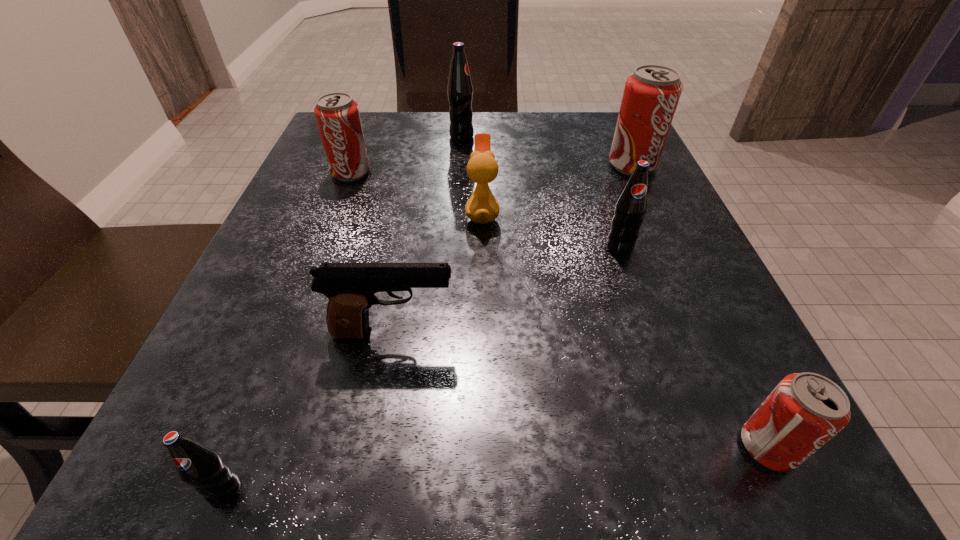
What are the coordinates of `vacant space that satisfies the following two spatial constraints: 1. on the beak of the tan duck; 2. on the right side of the nearest pink soda can` in the screenshot? It's located at (484, 447).

This screenshot has width=960, height=540. What are the coordinates of `free space that satisfies the following two spatial constraints: 1. at the barrel of the pistol; 2. on the right side of the nearest pink soda can` in the screenshot? It's located at (373, 447).

Locate an element on the screen. The image size is (960, 540). free spot that satisfies the following two spatial constraints: 1. on the beak of the duck; 2. on the front label of the leftmost black pop is located at coordinates (484, 490).

At what (x,y) coordinates should I click in order to perform the action: click on vacant space that satisfies the following two spatial constraints: 1. on the front label of the second black pop from right to left; 2. on the left side of the smallest pink soda can. Please return your answer as a coordinate pair (x, y). Looking at the image, I should click on (443, 447).

You are a GUI agent. You are given a task and a screenshot of the screen. Output one action in this format:
    pyautogui.click(x=<x>, y=<y>)
    Task: Click on the free location that satisfies the following two spatial constraints: 1. on the front side of the biggest pink soda can; 2. on the beak of the fourth farthest object
    This screenshot has height=540, width=960.
    Given the screenshot: What is the action you would take?
    pyautogui.click(x=654, y=213)

Locate an element on the screen. Image resolution: width=960 pixels, height=540 pixels. free space that satisfies the following two spatial constraints: 1. on the beak of the duck; 2. on the front label of the nearest black pop is located at coordinates (484, 490).

Locate an element on the screen. The height and width of the screenshot is (540, 960). vacant space that satisfies the following two spatial constraints: 1. on the beak of the smallest pink soda can; 2. on the left side of the duck is located at coordinates (484, 447).